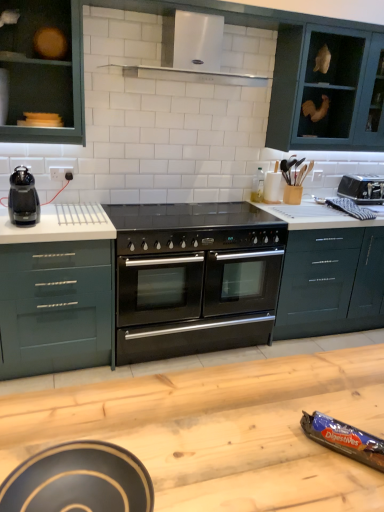
Question: Considering the positions of point (322, 332) and point (46, 270), is point (322, 332) closer or farther from the camera than point (46, 270)?

Choices:
 (A) closer
 (B) farther

Answer: (B)

Question: Is glossy dark green drawer at center-right, the first drawer in the right-to-left sequence, spatially inside green matte drawer at left, which ranks as the first drawer in left-to-right order, or outside of it?

Choices:
 (A) inside
 (B) outside

Answer: (B)

Question: Considering the real-world distances, which object is farthest from the matte black bowl at lower left, arranged as the 3th appliance when viewed from the right?

Choices:
 (A) green matte cabinet at upper center, acting as the second cabinetry starting from the right
 (B) green matte drawer at left, which ranks as the first drawer in left-to-right order
 (C) white stainless steel exhaust hood at upper center
 (D) glossy dark green drawer at center-right, the first drawer in the right-to-left sequence
 (E) black matte oven at center

Answer: (D)

Question: Which of these objects is positioned farthest from the matte green cabinet at upper left, positioned as the first cabinetry in left-to-right order?

Choices:
 (A) green matte cabinet at upper right, the 1th cabinetry when ordered from right to left
 (B) white stainless steel exhaust hood at upper center
 (C) green matte drawer at left, which ranks as the first drawer in left-to-right order
 (D) black plastic coffee maker at left
 (E) black glass gas stove at center

Answer: (A)